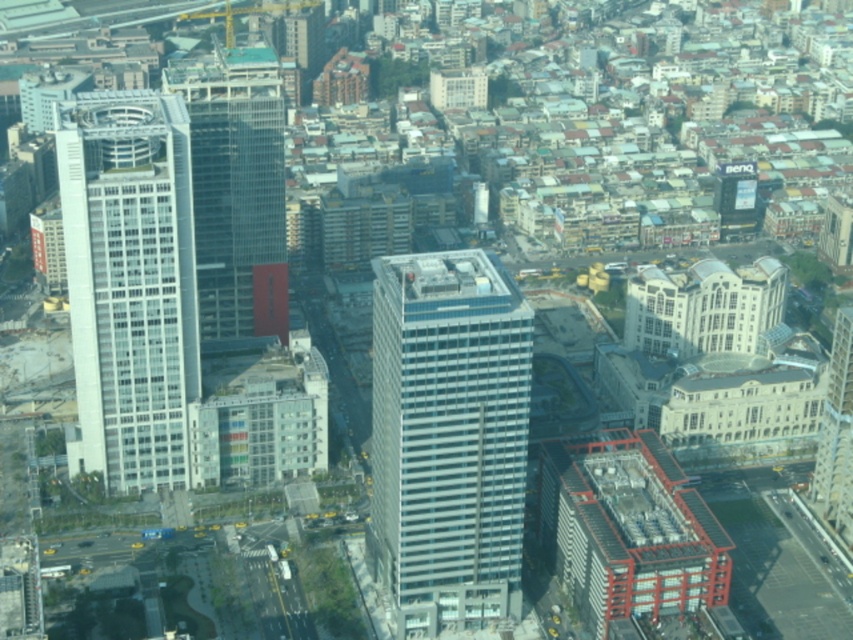
You are a drone operator tasked with capturing aerial footage of the city. Your drone is currently at coordinates point A. You need to fly it to the glassy white skyscraper at center. According to the map, where should you direct the drone to reach the skyscraper?

The glassy white skyscraper at center is located at point [448,435], so you should direct the drone to that coordinate to reach the skyscraper.